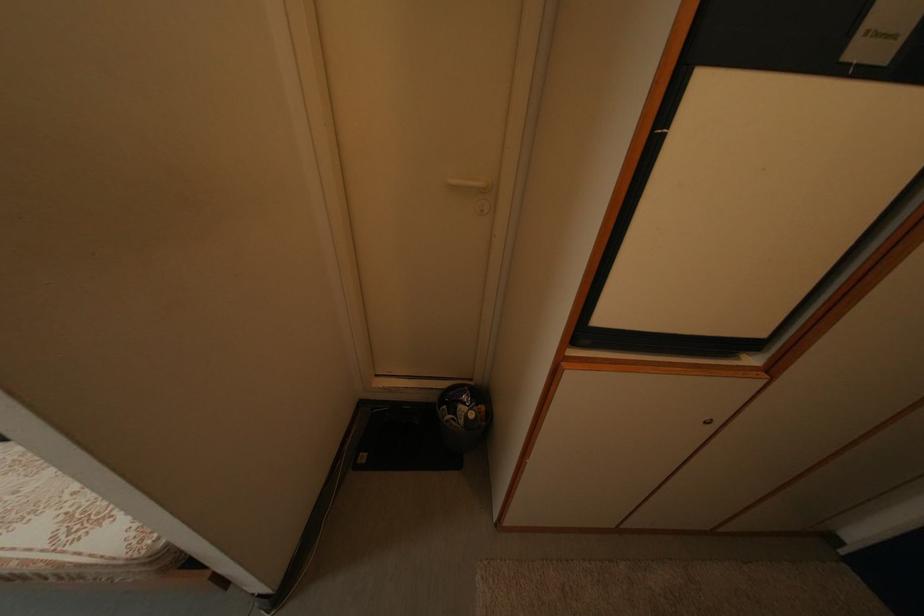
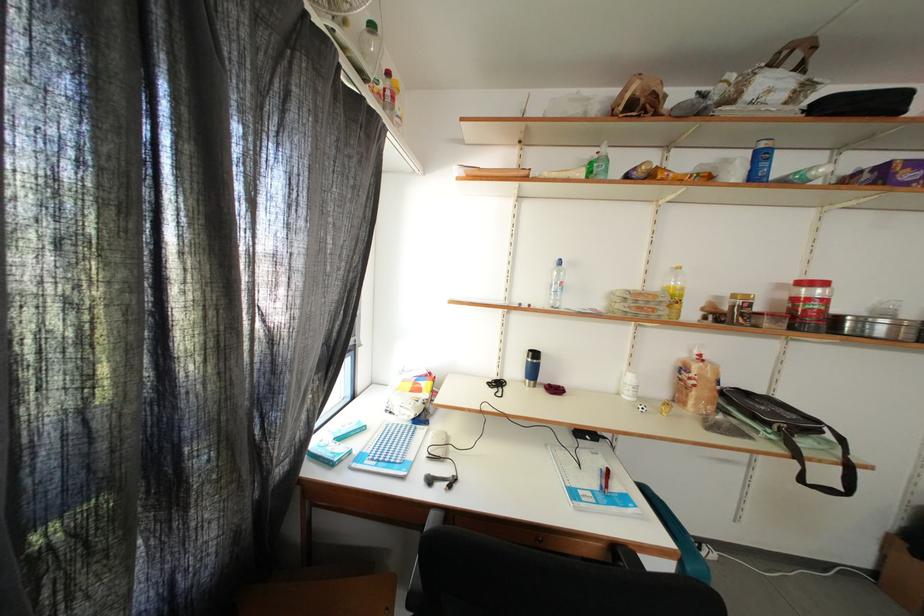
Question: In a continuous first-person perspective shot, in which direction is the camera moving?

Choices:
 (A) Left
 (B) Right
 (C) Forward
 (D) Backward

Answer: (A)